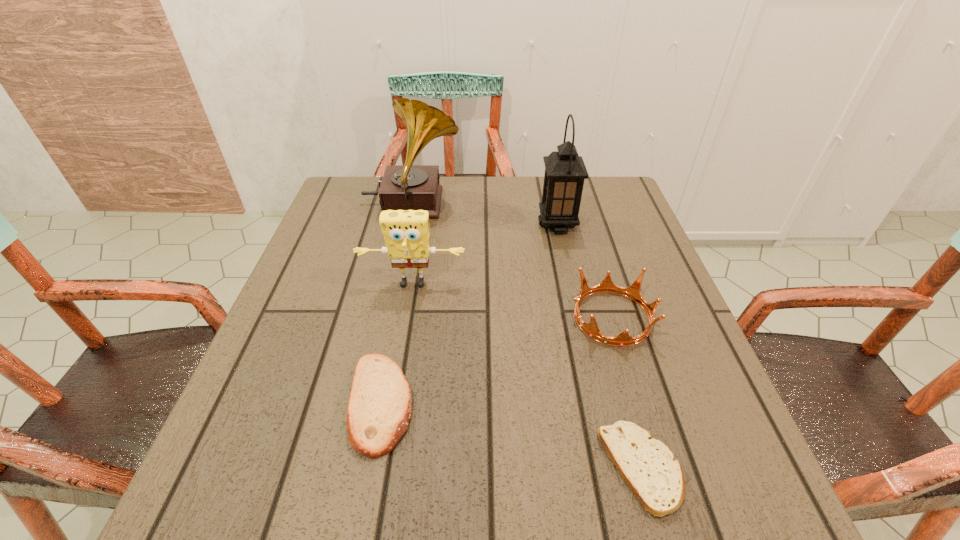
The width and height of the screenshot is (960, 540). In order to click on crown present at the right edge in this screenshot , I will do `click(633, 292)`.

This screenshot has height=540, width=960. What are the coordinates of `pita bread situated at the right edge` in the screenshot? It's located at (648, 466).

Find the location of a particular element. object that is positioned at the far left corner is located at coordinates (404, 187).

This screenshot has height=540, width=960. What are the coordinates of `object located at the far right corner` in the screenshot? It's located at (565, 171).

You are a GUI agent. You are given a task and a screenshot of the screen. Output one action in this format:
    pyautogui.click(x=<x>, y=<y>)
    Task: Click on the object located at the near right corner
    Image resolution: width=960 pixels, height=540 pixels.
    Given the screenshot: What is the action you would take?
    pyautogui.click(x=648, y=466)

I want to click on free space at the far edge of the desktop, so click(490, 189).

This screenshot has height=540, width=960. I want to click on vacant space at the left edge of the desktop, so click(358, 264).

This screenshot has height=540, width=960. I want to click on vacant position at the right edge of the desktop, so click(732, 430).

Locate an element on the screen. The width and height of the screenshot is (960, 540). vacant space at the far left corner of the desktop is located at coordinates (338, 192).

I want to click on free space at the far right corner of the desktop, so click(619, 214).